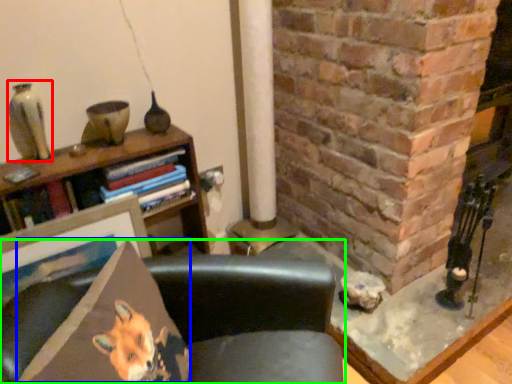
Question: Which object is positioned closest to gray (highlighted by a red box)? Select from throw pillow (highlighted by a blue box) and chair (highlighted by a green box).

Choices:
 (A) throw pillow
 (B) chair

Answer: (A)